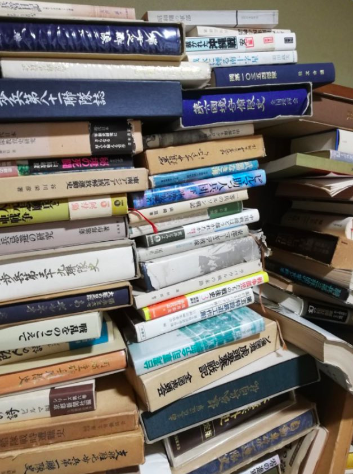
Where is `brown book on top of far right stack`? Image resolution: width=353 pixels, height=474 pixels. brown book on top of far right stack is located at coordinates (336, 93).